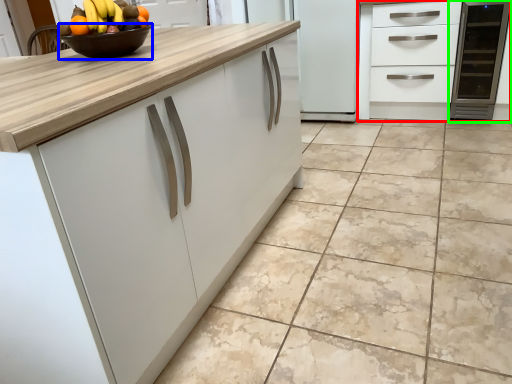
Question: Which is farther away from cabinetry (highlighted by a red box)? bowl (highlighted by a blue box) or appliance (highlighted by a green box)?

Choices:
 (A) bowl
 (B) appliance

Answer: (A)